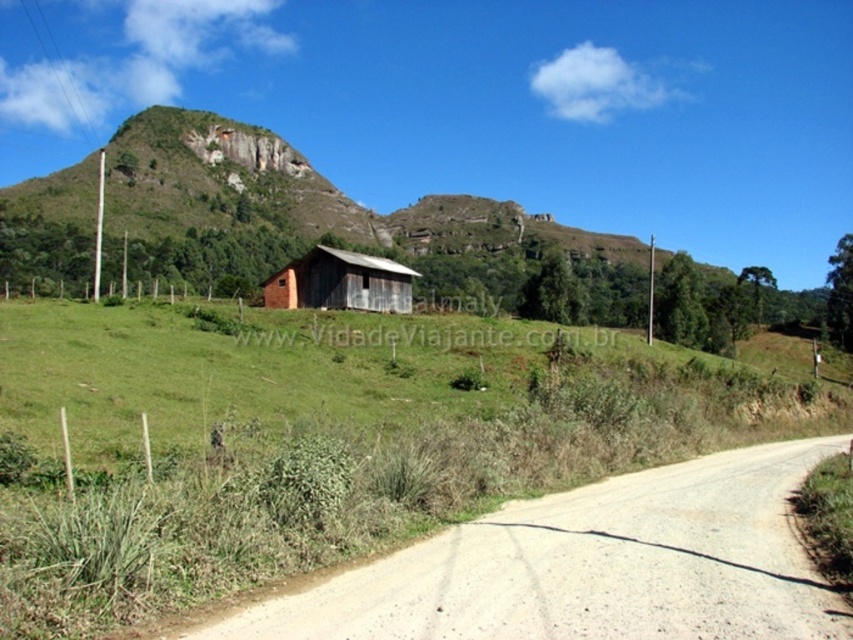
Can you confirm if brown gravel road at lower left is bigger than rustic wooden barn at center?

No.

Who is positioned more to the left, brown gravel road at lower left or rustic wooden barn at center?

rustic wooden barn at center

The image size is (853, 640). Identify the location of brown gravel road at lower left. (590, 564).